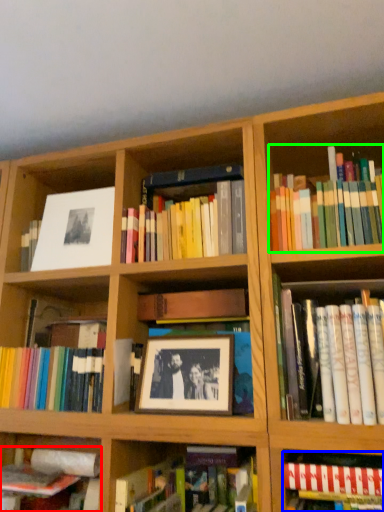
Question: Based on their relative distances, which object is nearer to book (highlighted by a red box)? Choose from book (highlighted by a blue box) and book (highlighted by a green box).

Choices:
 (A) book
 (B) book

Answer: (A)